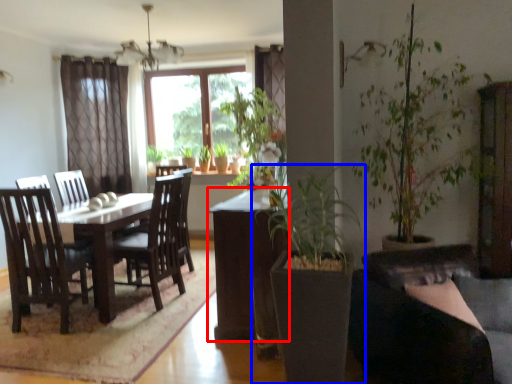
Question: Which of the following is the farthest to the observer, table (highlighted by a red box) or houseplant (highlighted by a blue box)?

Choices:
 (A) table
 (B) houseplant

Answer: (A)